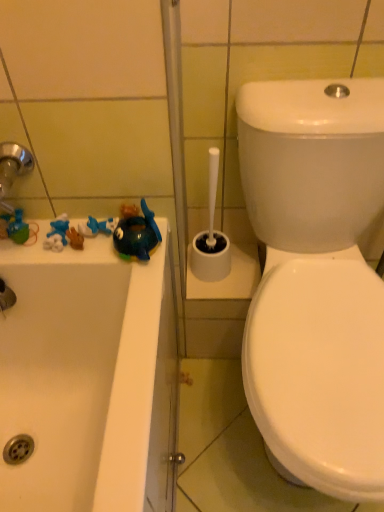
Where is `vacant area that lies to the right of white plastic toilet brush holder at center`? The height and width of the screenshot is (512, 384). vacant area that lies to the right of white plastic toilet brush holder at center is located at coordinates (246, 267).